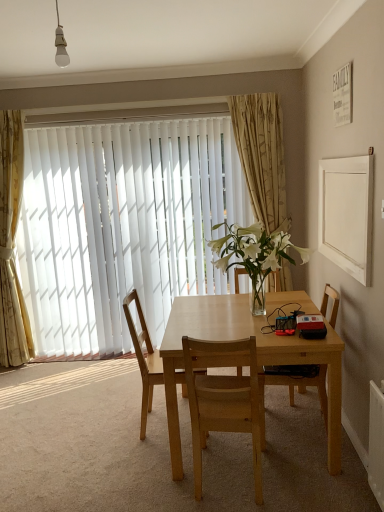
Question: Is light wood chair at center, the first chair when ordered from left to right, wider than white matte frame at upper right?

Choices:
 (A) no
 (B) yes

Answer: (B)

Question: From the image's perspective, is light wood chair at center, placed as the 3th chair when sorted from right to left, above white matte frame at upper right?

Choices:
 (A) no
 (B) yes

Answer: (A)

Question: Can you confirm if light wood chair at center, placed as the 3th chair when sorted from right to left, is taller than white matte frame at upper right?

Choices:
 (A) yes
 (B) no

Answer: (A)

Question: Is light wood chair at center, placed as the 3th chair when sorted from right to left, looking in the opposite direction of white matte frame at upper right?

Choices:
 (A) yes
 (B) no

Answer: (B)

Question: Is light wood chair at center, placed as the 3th chair when sorted from right to left, behind white matte frame at upper right?

Choices:
 (A) yes
 (B) no

Answer: (A)

Question: Is light wood chair at center, placed as the 3th chair when sorted from right to left, smaller than white matte frame at upper right?

Choices:
 (A) yes
 (B) no

Answer: (B)

Question: Considering the relative sizes of white matte frame at upper right and clear glass vase at center in the image provided, is white matte frame at upper right shorter than clear glass vase at center?

Choices:
 (A) yes
 (B) no

Answer: (B)

Question: Is white matte frame at upper right positioned behind clear glass vase at center?

Choices:
 (A) no
 (B) yes

Answer: (A)

Question: Is white matte frame at upper right outside clear glass vase at center?

Choices:
 (A) no
 (B) yes

Answer: (B)

Question: From a real-world perspective, is white matte frame at upper right on clear glass vase at center?

Choices:
 (A) no
 (B) yes

Answer: (B)

Question: Is white matte frame at upper right not near clear glass vase at center?

Choices:
 (A) yes
 (B) no

Answer: (B)

Question: Is white matte frame at upper right placed right next to clear glass vase at center?

Choices:
 (A) no
 (B) yes

Answer: (A)

Question: Is clear glass vase at center positioned behind light brown wood chair at center, the second chair from the left?

Choices:
 (A) yes
 (B) no

Answer: (A)